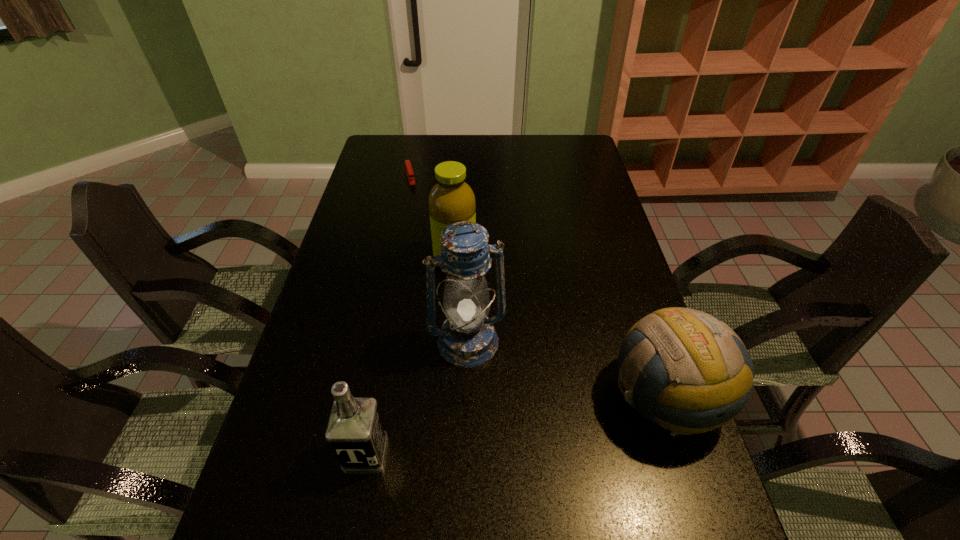
You are a GUI agent. You are given a task and a screenshot of the screen. Output one action in this format:
    pyautogui.click(x=<x>, y=<y>)
    Task: Click on the free space on the desktop that is between the vodka and the rightmost object and is positioned on the front label of the fruit juice
    Image resolution: width=960 pixels, height=540 pixels.
    Given the screenshot: What is the action you would take?
    pyautogui.click(x=525, y=423)

Image resolution: width=960 pixels, height=540 pixels. In order to click on vacant spot on the desktop that is between the vodka and the volleyball and is positioned on the front-facing side of the stapler in this screenshot , I will do `click(488, 430)`.

Find the location of a particular element. vacant space on the desktop that is between the vodka and the volleyball and is positioned on the front-facing side of the tallest object is located at coordinates (498, 428).